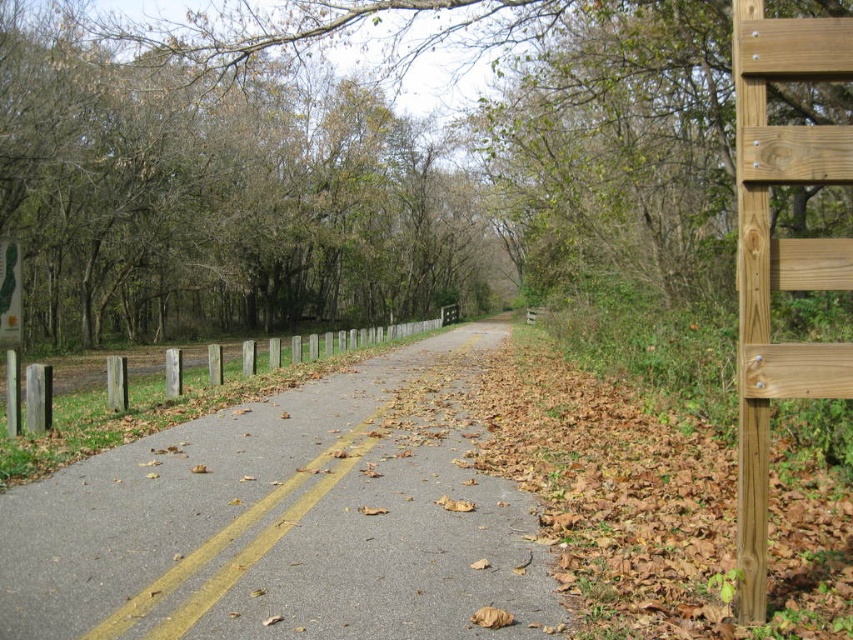
Question: Can you confirm if gray asphalt road at center is positioned below green plastic sign at left?

Choices:
 (A) yes
 (B) no

Answer: (A)

Question: Does gray asphalt road at center appear on the right side of green plastic sign at left?

Choices:
 (A) yes
 (B) no

Answer: (A)

Question: Which object is closer to the camera taking this photo?

Choices:
 (A) gray asphalt road at center
 (B) green plastic sign at left

Answer: (A)

Question: Is gray asphalt road at center bigger than green plastic sign at left?

Choices:
 (A) no
 (B) yes

Answer: (B)